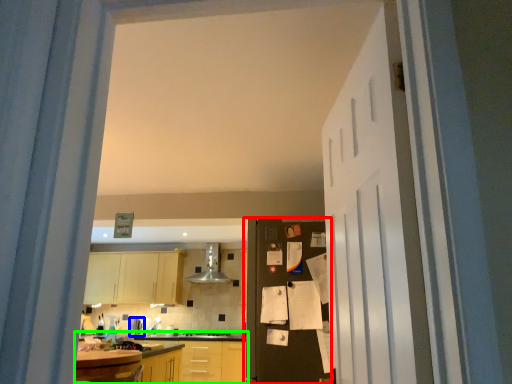
Question: Based on their relative distances, which object is farther from door (highlighted by a red box)? Choose from appliance (highlighted by a blue box) and countertop (highlighted by a green box).

Choices:
 (A) appliance
 (B) countertop

Answer: (A)